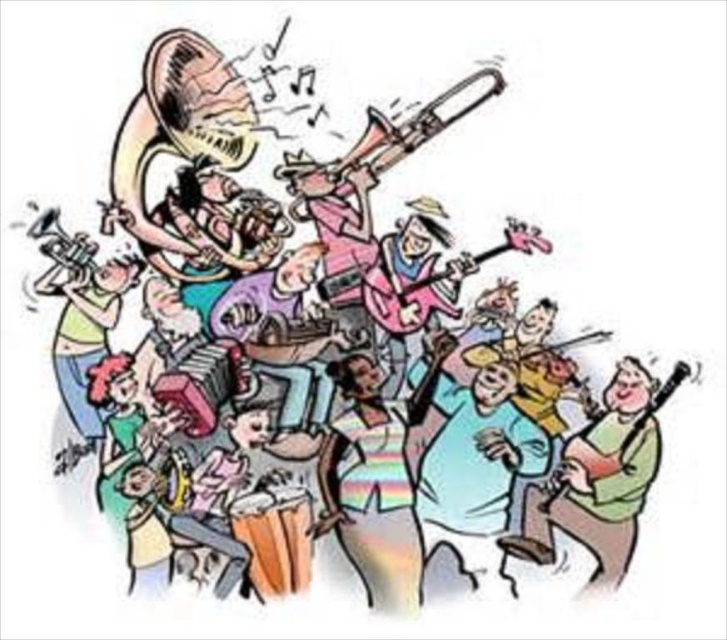
Which is behind, point (409, 147) or point (656, 401)?

Positioned behind is point (409, 147).

Can you confirm if metallic brass trumpet at upper center is bigger than matte black guitar at right?

Yes, metallic brass trumpet at upper center is bigger than matte black guitar at right.

Is point (473, 100) farther from viewer compared to point (651, 401)?

Yes, it is.

What are the coordinates of `metallic brass trumpet at upper center` in the screenshot? It's located at (385, 141).

Between pink matte guitar at center and matte black guitar at right, which one is positioned lower?

matte black guitar at right is below.

Who is more distant from viewer, (x=377, y=264) or (x=666, y=400)?

Positioned behind is point (x=377, y=264).

Find the location of a particular element. pink matte guitar at center is located at coordinates (435, 282).

What are the coordinates of `pink matte guitar at center` in the screenshot? It's located at (435, 282).

Does point (317, 163) lie behind point (401, 310)?

No, it is not.

Based on the photo, is metallic brass trumpet at upper center thinner than pink matte guitar at center?

In fact, metallic brass trumpet at upper center might be wider than pink matte guitar at center.

Describe the element at coordinates (385, 141) in the screenshot. I see `metallic brass trumpet at upper center` at that location.

This screenshot has height=640, width=727. Find the location of `metallic brass trumpet at upper center`. metallic brass trumpet at upper center is located at coordinates (385, 141).